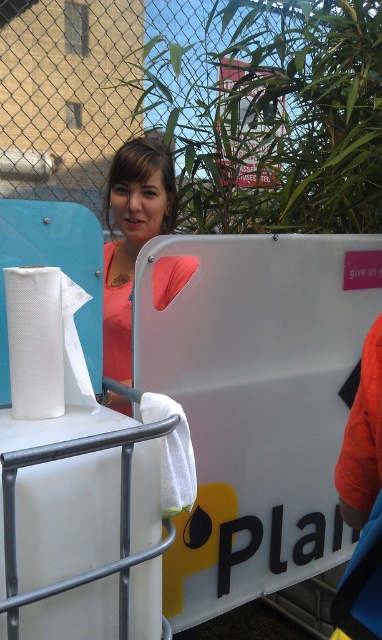
Between point (121, 244) and point (69, 314), which one is positioned in front?

Positioned in front is point (69, 314).

Who is more distant from viewer, (129,378) or (82,378)?

Point (129,378)

Where is `pink matte shirt at center`? pink matte shirt at center is located at coordinates (132, 237).